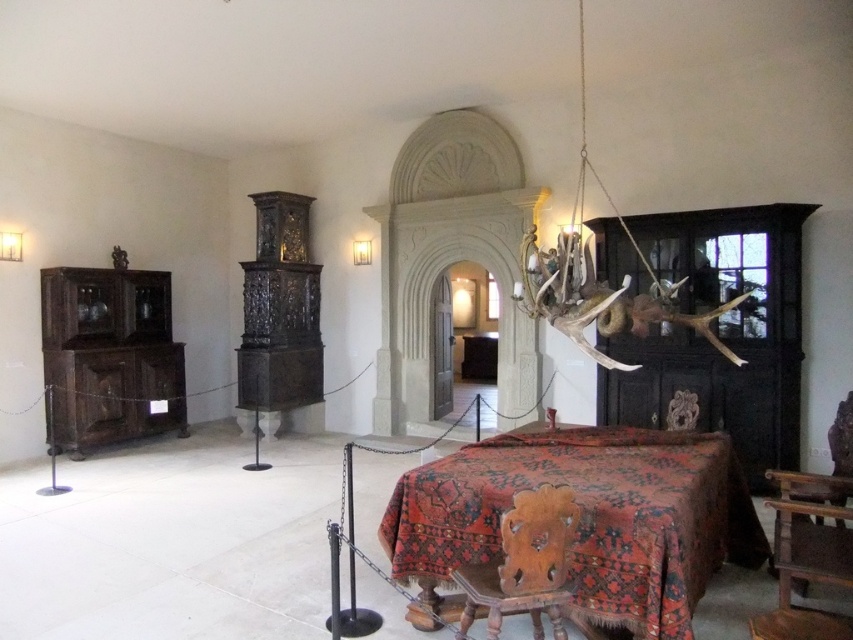
Question: Which point is closer to the camera taking this photo?

Choices:
 (A) (840, 419)
 (B) (827, 634)

Answer: (B)

Question: Does dark brown wood cabinet at left have a lesser width compared to wooden chair at lower right?

Choices:
 (A) no
 (B) yes

Answer: (A)

Question: Is carpeted wooden table at center smaller than dark brown wooden chair at right?

Choices:
 (A) no
 (B) yes

Answer: (A)

Question: Estimate the real-world distances between objects in this image. Which object is farther from the dark brown wood cabinet at left?

Choices:
 (A) wooden carved chair at center
 (B) dark brown wooden chair at right
 (C) wooden chair at lower right
 (D) carpeted wooden table at center

Answer: (B)

Question: Observing the image, what is the correct spatial positioning of carpeted wooden table at center in reference to wooden chair at lower right?

Choices:
 (A) above
 (B) below

Answer: (B)

Question: Which is farther from the wooden carved chair at center?

Choices:
 (A) wooden chair at lower right
 (B) carpeted wooden table at center

Answer: (A)